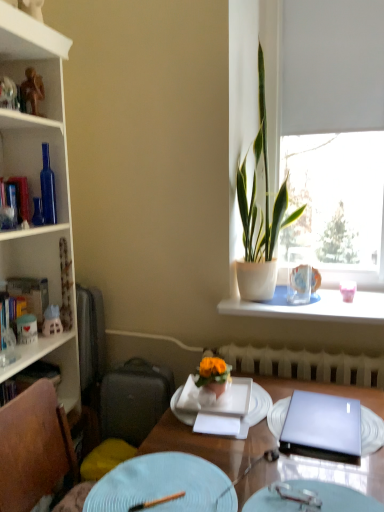
Find the location of a particular element. vacant area that lies between satin purple laptop at center and wooden chopstick at lower center, the 1th tableware when ordered from left to right is located at coordinates (246, 463).